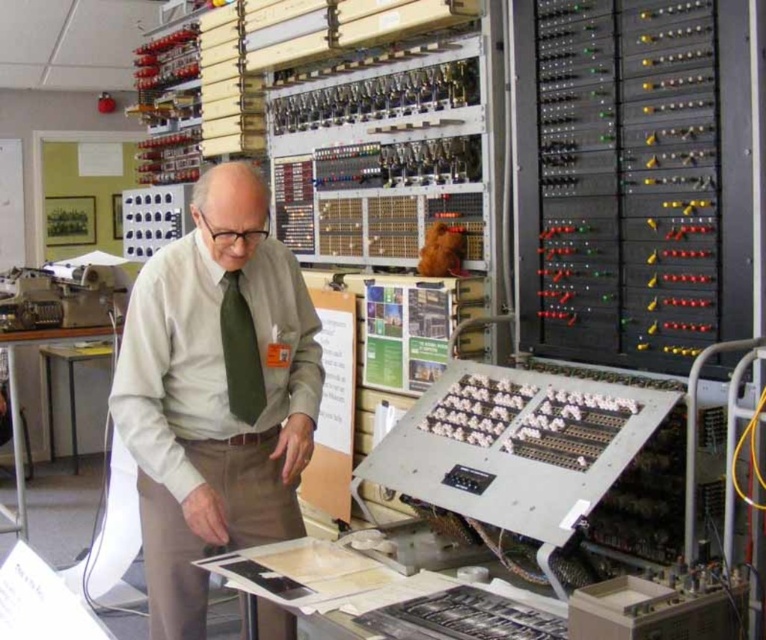
Can you confirm if light beige shirt at center is bigger than green silk tie at center?

Indeed, light beige shirt at center has a larger size compared to green silk tie at center.

Can you confirm if light beige shirt at center is taller than green silk tie at center?

Yes, light beige shirt at center is taller than green silk tie at center.

At what (x,y) coordinates should I click in order to perform the action: click on light beige shirt at center. Please return your answer as a coordinate pair (x, y). This screenshot has width=766, height=640. Looking at the image, I should click on (215, 394).